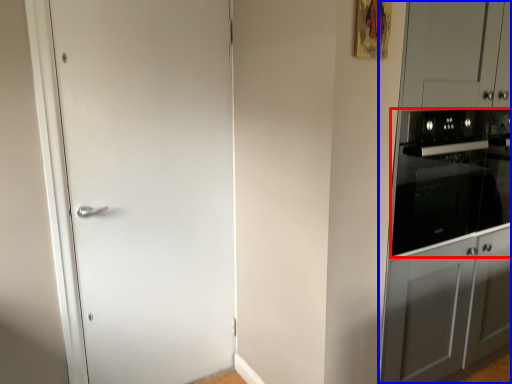
Question: Among these objects, which one is farthest to the camera, home appliance (highlighted by a red box) or dresser (highlighted by a blue box)?

Choices:
 (A) home appliance
 (B) dresser

Answer: (A)